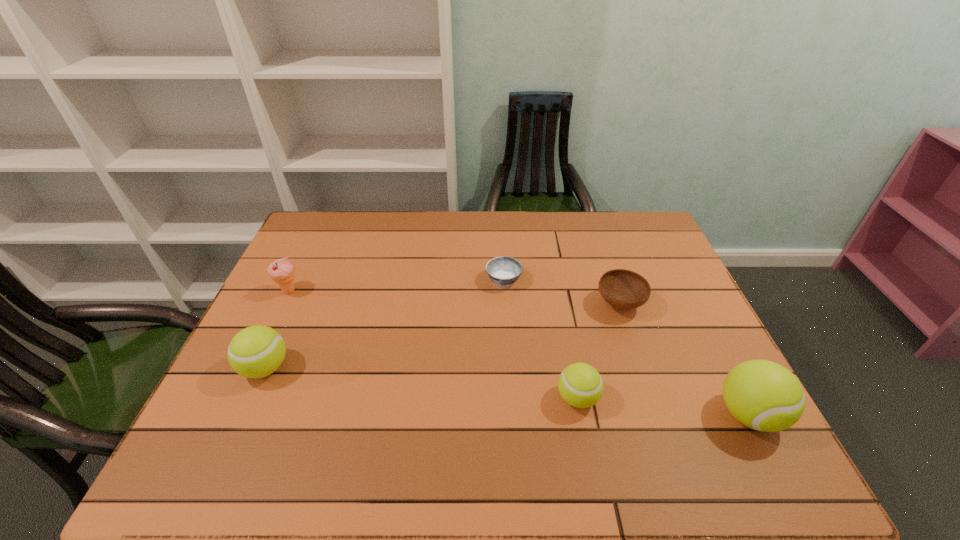
The height and width of the screenshot is (540, 960). Identify the location of free spot between the second shortest tennis ball and the icecream. (277, 329).

Find the location of a particular element. free area in between the ashtray and the fifth object from left to right is located at coordinates (562, 292).

Where is `free space between the second shortest object and the shortest object`? The width and height of the screenshot is (960, 540). free space between the second shortest object and the shortest object is located at coordinates (562, 292).

The height and width of the screenshot is (540, 960). Identify the location of empty space that is in between the bowl and the shortest object. (562, 292).

This screenshot has height=540, width=960. What are the coordinates of `vacant space that's between the rightmost object and the fourth object from left to right` in the screenshot? It's located at (663, 407).

Locate an element on the screen. free space between the rightmost tennis ball and the icecream is located at coordinates (519, 353).

Image resolution: width=960 pixels, height=540 pixels. I want to click on object that ranks as the fourth closest to the icecream, so click(x=623, y=289).

Find the location of a particular element. object that stands as the fifth closest to the second tennis ball from right to left is located at coordinates (282, 271).

Locate which tennis ball is the closest to the second tennis ball from left to right. Please provide its 2D coordinates. Your answer should be formatted as a tuple, i.e. [(x, y)], where the tuple contains the x and y coordinates of a point satisfying the conditions above.

[(765, 396)]

At what (x,y) coordinates should I click in order to perform the action: click on tennis ball identified as the closest to the icecream. Please return your answer as a coordinate pair (x, y). Looking at the image, I should click on tap(257, 351).